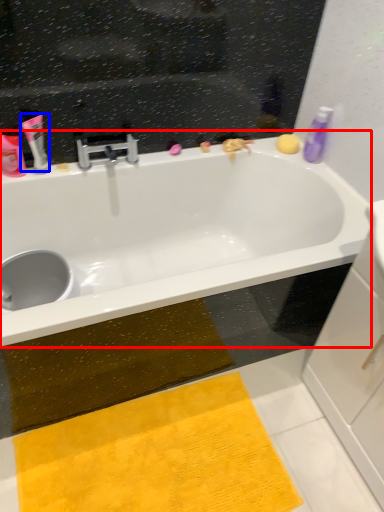
Question: Which of the following is the closest to the observer, bathtub (highlighted by a red box) or toiletry (highlighted by a blue box)?

Choices:
 (A) bathtub
 (B) toiletry

Answer: (A)